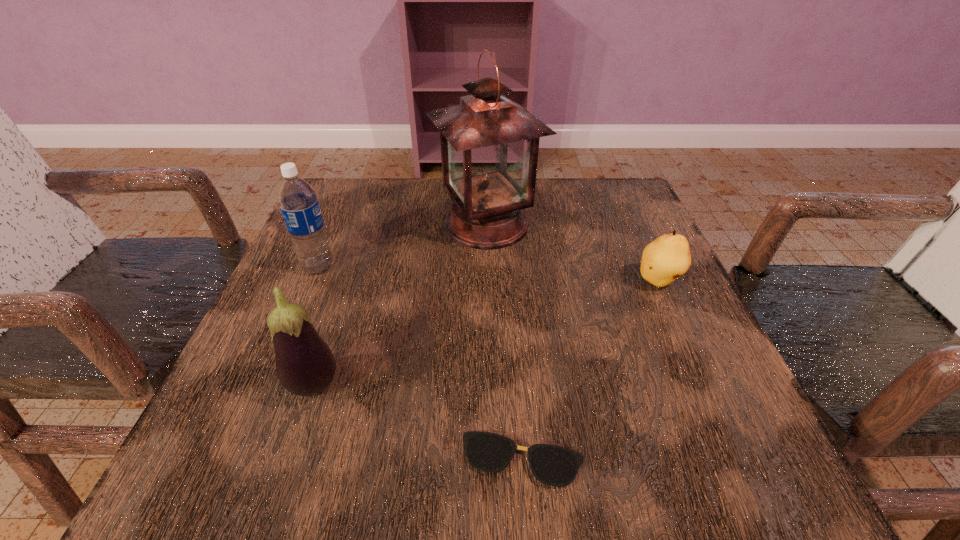
I want to click on empty location between the eggplant and the leftmost object, so click(317, 327).

Identify the location of vacant region between the shortest object and the eggplant. This screenshot has height=540, width=960. coord(419,423).

Where is `vacant area that lies between the fourth tallest object and the oil lamp`? vacant area that lies between the fourth tallest object and the oil lamp is located at coordinates (573, 253).

I want to click on empty space between the water bottle and the nearest object, so pyautogui.click(x=420, y=363).

At what (x,y) coordinates should I click in order to perform the action: click on object that ranks as the fourth closest to the second nearest object. Please return your answer as a coordinate pair (x, y). This screenshot has height=540, width=960. Looking at the image, I should click on (664, 260).

You are a GUI agent. You are given a task and a screenshot of the screen. Output one action in this format:
    pyautogui.click(x=<x>, y=<y>)
    Task: Click on the object that is the second closest one to the rightmost object
    The image size is (960, 540).
    Given the screenshot: What is the action you would take?
    pyautogui.click(x=552, y=465)

This screenshot has height=540, width=960. What are the coordinates of `vacant space that satisfies the following two spatial constraints: 1. on the front side of the second object from left to right; 2. on the right side of the nearest object` in the screenshot? It's located at (290, 460).

I want to click on free space that satisfies the following two spatial constraints: 1. on the front side of the tallest object; 2. on the left side of the shortest object, so click(492, 460).